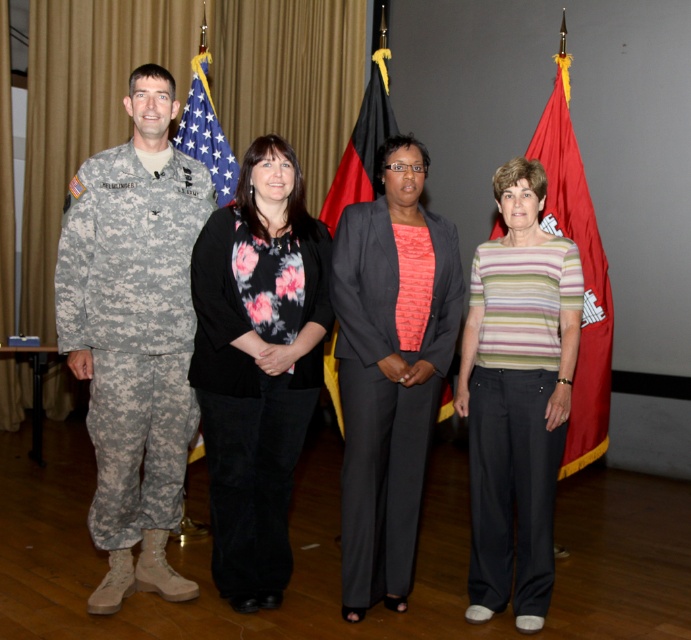
Based on the coordinates provided, which flag is located at point [583,273]?

The point [583,273] indicates the red fabric flag at right.

You are standing at the camera position and want to hand a document to the person closest to the red fabric flag at right. Which person should you hand it to?

The person closest to the red fabric flag at right is the fourth individual dressed in a striped, short sleeved shirt and dark pants.